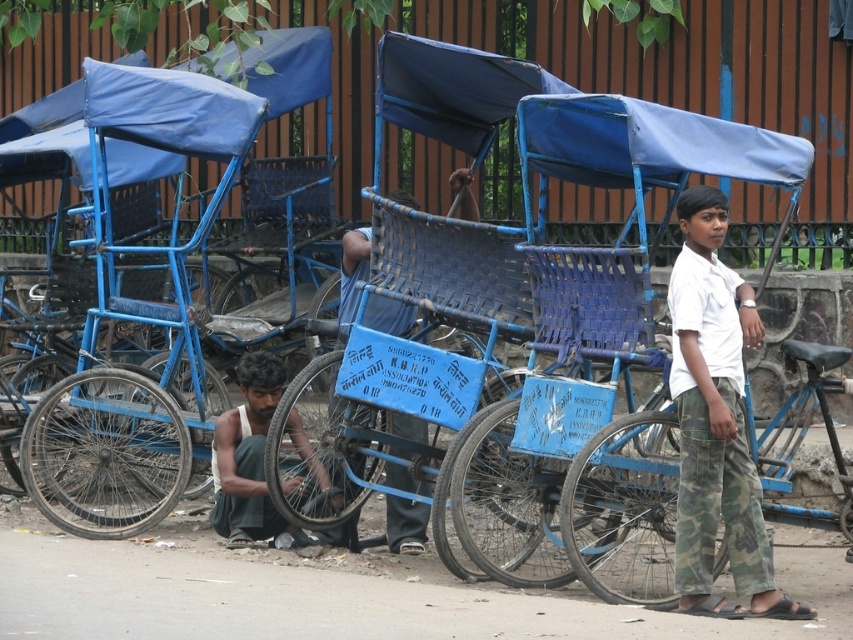
You are a photographer standing at the roadside wanting to take a closeup shot of the white cotton shirt at center. Given that your camera can focus on objects within 10 meters, will you be able to capture a clear closeup?

The white cotton shirt at center is 12.01 meters away from the camera, which is beyond the 10 meter focus range. Therefore, you won t be able to capture a clear closeup.

You are a delivery person who needs to move a package from the dark blue fabric bicycle at lower left to the white cotton shirt at center. Can you carry the package without walking through the rickshaws?

The distance between the dark blue fabric bicycle at lower left and the white cotton shirt at center is 4.06 meters. Since there is a clear path between them, you can carry the package without needing to walk through the rickshaws.